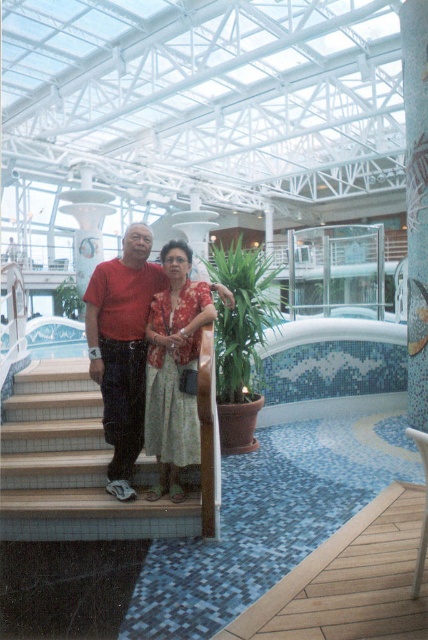
Is wooden stairs at center wider than blue mosaic tile pool at center?

No.

Can you confirm if wooden stairs at center is shorter than blue mosaic tile pool at center?

No.

Between point (47, 481) and point (377, 326), which one is positioned behind?

The point (377, 326) is more distant.

Image resolution: width=428 pixels, height=640 pixels. What are the coordinates of `wooden stairs at center` in the screenshot? It's located at (73, 467).

Is green leafy plant at center closer to the viewer compared to green leafy plant at upper center?

Yes, green leafy plant at center is closer to the viewer.

Is point (249, 340) positioned in front of point (77, 291)?

Yes.

At what (x,y) coordinates should I click in order to perform the action: click on green leafy plant at center. Please return your answer as a coordinate pair (x, y). This screenshot has height=640, width=428. Looking at the image, I should click on (241, 317).

Is point (118, 460) closer to viewer compared to point (71, 300)?

Yes, point (118, 460) is closer to viewer.

Does matte red shirt at center appear on the left side of green leafy plant at upper center?

In fact, matte red shirt at center is to the right of green leafy plant at upper center.

Does point (146, 308) lie in front of point (73, 317)?

Yes.

At what (x,y) coordinates should I click in order to perform the action: click on matte red shirt at center. Please return your answer as a coordinate pair (x, y). Looking at the image, I should click on (121, 339).